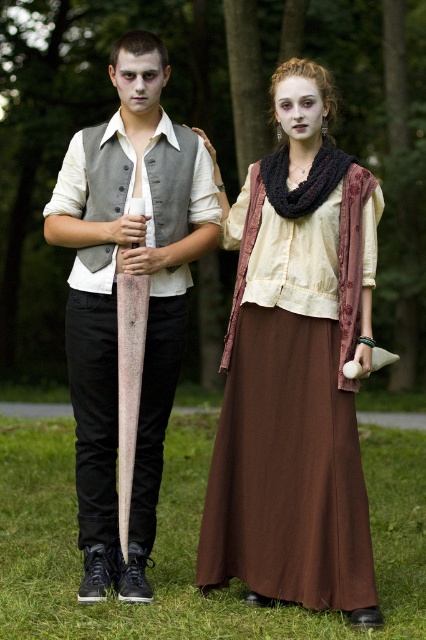
You are a fashion designer observing a model wearing the matte brown dress at center and matte gray vest at center. Which clothing item is positioned lower on the model?

The matte brown dress at center is positioned lower than the matte gray vest at center.

Looking at this image, you are organizing a costume party and need to ensure that the matte brown dress at center and the matte gray vest at center can be displayed side by side on a mannequin. Given that the display area is only 1 meter wide, will both items fit comfortably without overlapping?

The matte brown dress at center is wider than the matte gray vest at center. Since the total width of both items combined would exceed 1 meter, they cannot fit comfortably side by side without overlapping in the display area.

You are a photographer trying to capture a portrait of both the matte brown dress at center and the matte gray vest at center. Since you want them both in focus, you need to know their positions relative to each other. Which object is positioned to the right of the other?

The matte brown dress at center is to the right of the matte gray vest at center.